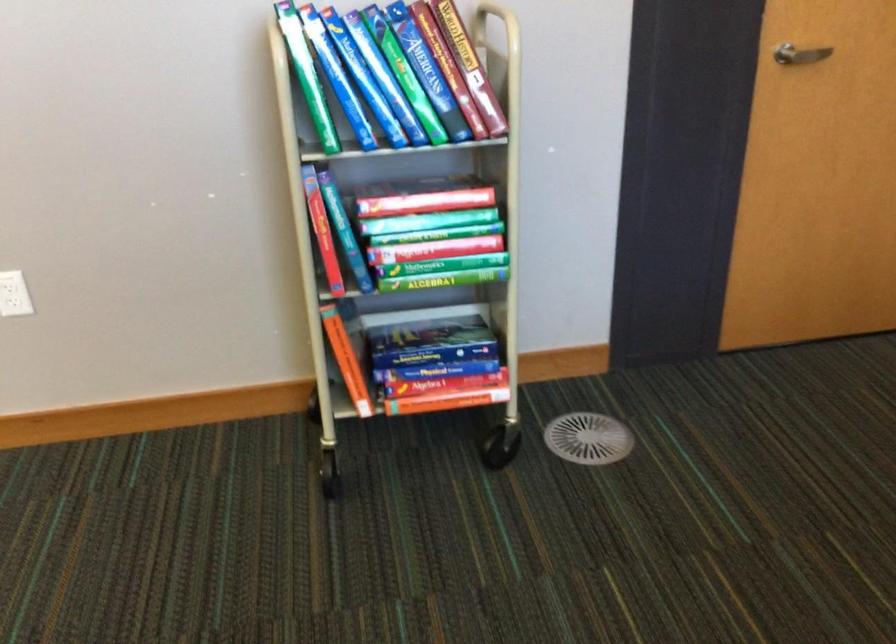
Find where to pull the silver door handle. Please return your answer as a coordinate pair (x, y).

(799, 55)